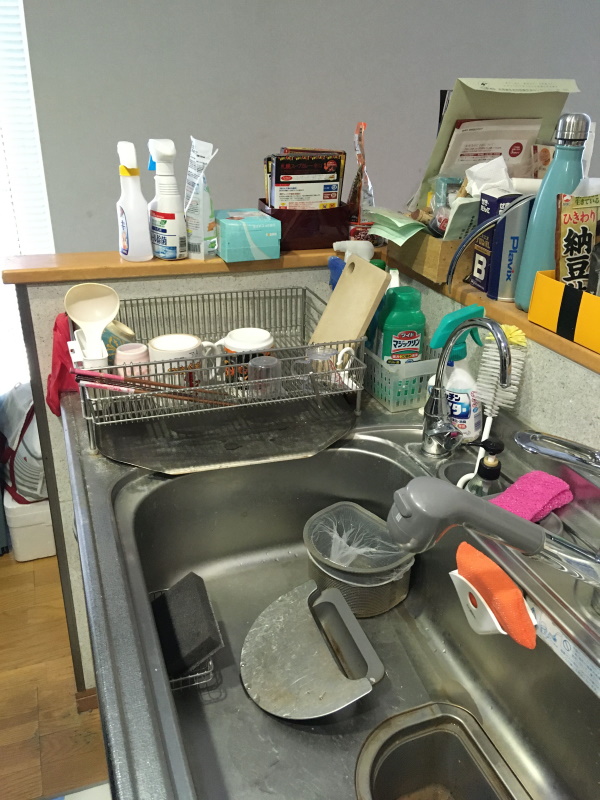
Image resolution: width=600 pixels, height=800 pixels. I want to click on wooden box, so click(422, 254).